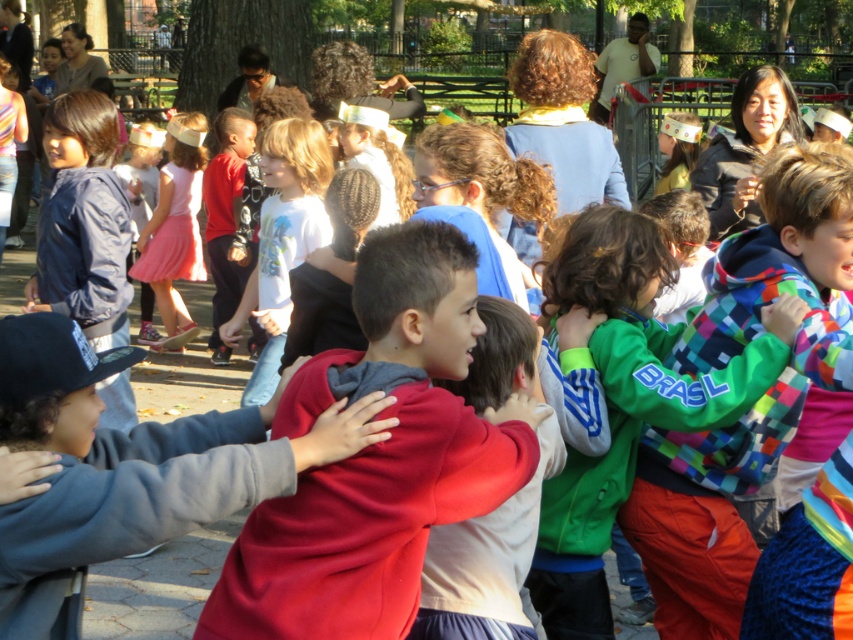
Question: Does red fleece sweatshirt at center lie in front of red fleece jacket at center?

Choices:
 (A) no
 (B) yes

Answer: (B)

Question: Does green fleece jacket at center have a smaller size compared to pink satin dress at center?

Choices:
 (A) yes
 (B) no

Answer: (A)

Question: Which object appears farthest from the camera in this image?

Choices:
 (A) red fleece jacket at center
 (B) matte red hoodie at center
 (C) green fleece jacket at center
 (D) red fleece sweatshirt at center

Answer: (C)

Question: Is green fleece jacket at center to the right of pink satin dress at center from the viewer's perspective?

Choices:
 (A) no
 (B) yes

Answer: (B)

Question: Which object is closer to the camera taking this photo?

Choices:
 (A) red fleece sweatshirt at center
 (B) pink satin dress at center

Answer: (A)

Question: Which object appears farthest from the camera in this image?

Choices:
 (A) red fleece sweatshirt at center
 (B) matte red hoodie at center
 (C) red fleece jacket at center
 (D) white matte shirt at center

Answer: (D)